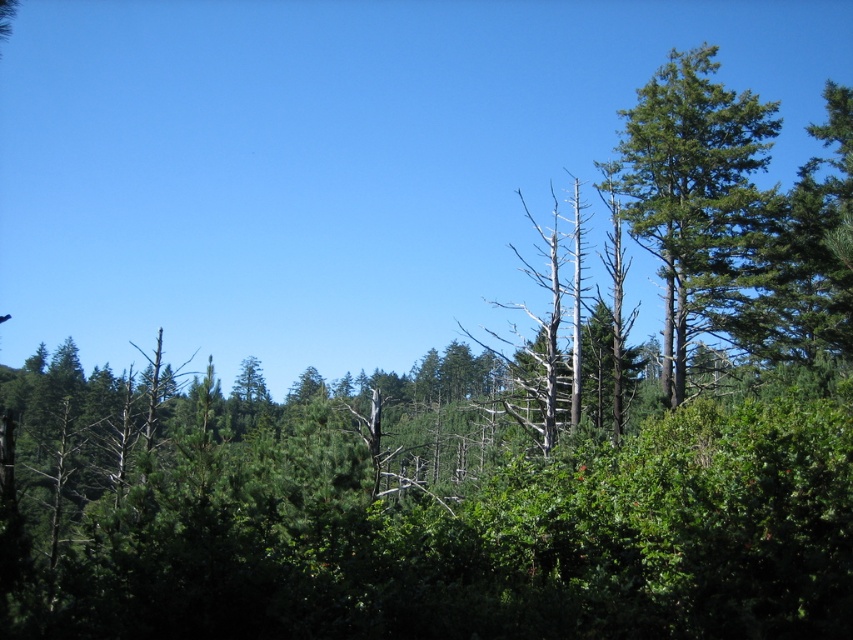
You are standing in the forest and want to reach a specific point marked as point (703, 259). If your walking speed is 3 feet per second, how many seconds will it take you to reach that point?

The distance between point (703, 259) and the viewer is 90.24 feet. At a walking speed of 3 feet per second, it would take 90.24 divided by 3 equals 30.08 seconds to reach the point.

From the picture: You are a hiker who needs to identify the tallest tree in this forest scene. Based on the image, which tree should you consider as the tallest between the green textured tree at right and the dead wood tree at center?

The green textured tree at right is larger in size than the dead wood tree at center, so it is the tallest tree in the forest scene.

You are a hiker trying to navigate through the forest. You see a green textured tree at right and a dead wood tree at center. Which tree has a wider trunk?

The green textured tree at right has a wider trunk than the dead wood tree at center because its width surpasses the latter.